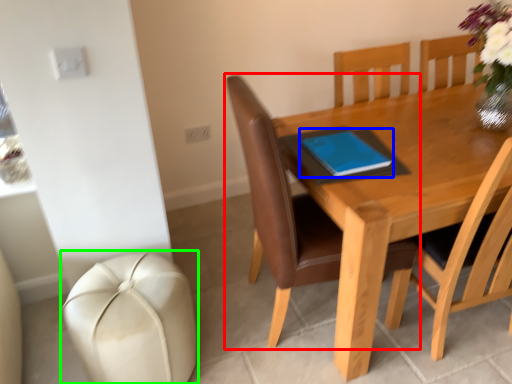
Question: Which object is positioned farthest from chair (highlighted by a red box)? Select from notebook (highlighted by a blue box) and swivel chair (highlighted by a green box).

Choices:
 (A) notebook
 (B) swivel chair

Answer: (B)